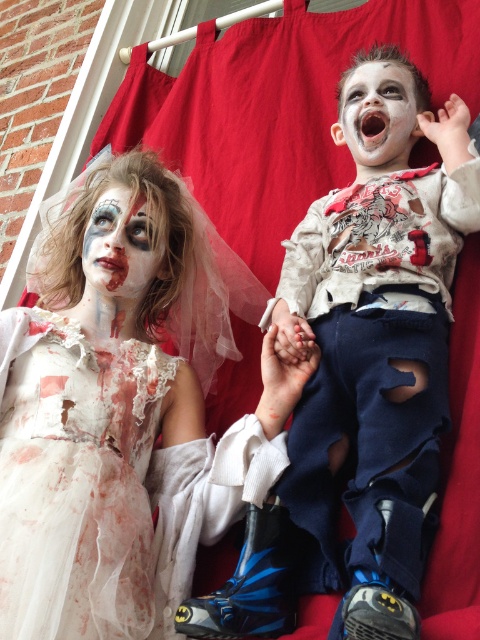
You are a photographer trying to capture a closeup shot of both the white lace dress at left and the white matte face at upper right. Which object would you need to zoom in more on to ensure it appears detailed in the photo?

The white lace dress at left has a larger size compared to the white matte face at upper right, so you would need to zoom in more on the white matte face at upper right to ensure it appears detailed in the photo.